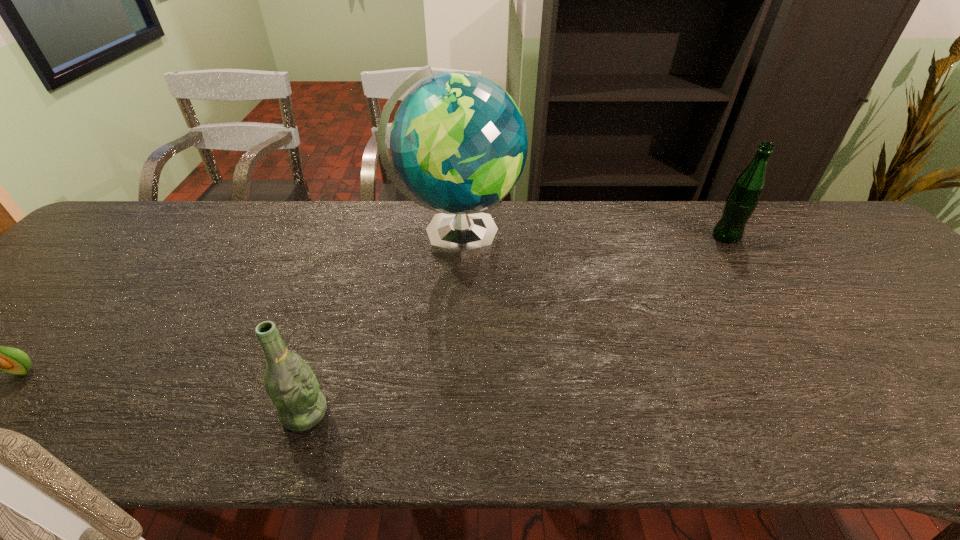
You are a GUI agent. You are given a task and a screenshot of the screen. Output one action in this format:
    pyautogui.click(x=<x>, y=<y>)
    Task: Click on the tallest object
    Image resolution: width=960 pixels, height=540 pixels.
    Given the screenshot: What is the action you would take?
    pyautogui.click(x=458, y=142)

Identify the location of globe. This screenshot has height=540, width=960. (458, 142).

Find the location of a particular element. Image resolution: width=960 pixels, height=540 pixels. the right beer bottle is located at coordinates (741, 202).

Where is `the rightmost object`? the rightmost object is located at coordinates (741, 202).

Where is `the left beer bottle`? the left beer bottle is located at coordinates (290, 383).

Where is `the nearest object`? The height and width of the screenshot is (540, 960). the nearest object is located at coordinates (290, 383).

At what (x,y) coordinates should I click in order to perform the action: click on vacant space located on the front surface of the globe. Please return your answer as a coordinate pair (x, y). The width and height of the screenshot is (960, 540). Looking at the image, I should click on (628, 237).

You are a GUI agent. You are given a task and a screenshot of the screen. Output one action in this format:
    pyautogui.click(x=<x>, y=<y>)
    Task: Click on the free space located on the left of the right beer bottle
    The width and height of the screenshot is (960, 540).
    Given the screenshot: What is the action you would take?
    pyautogui.click(x=664, y=237)

This screenshot has width=960, height=540. I want to click on free space located 0.150m on the surface of the third object from right to left, so click(405, 413).

Where is `globe that is at the far edge`? globe that is at the far edge is located at coordinates (458, 142).